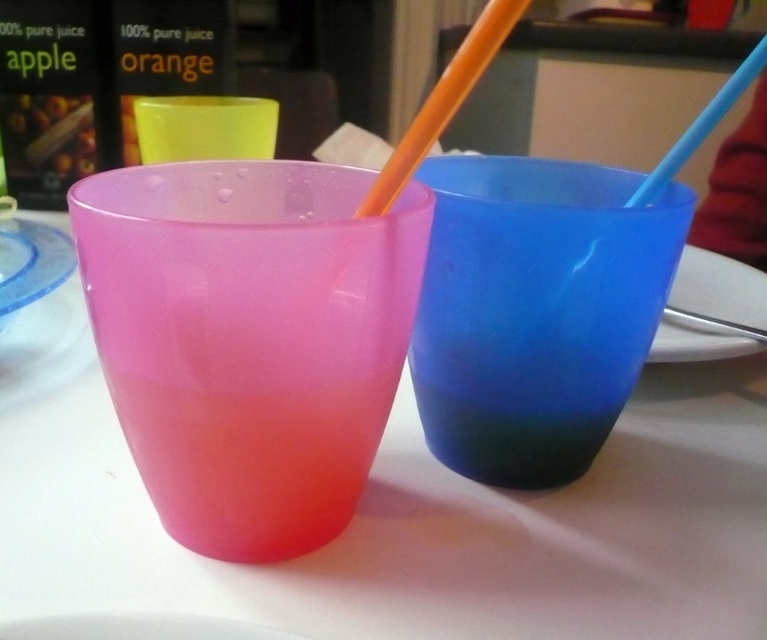
Which is behind, point (31, 604) or point (212, 508)?

Positioned behind is point (212, 508).

Is transparent plastic cups at center closer to camera compared to frosted pink cup at left?

No, transparent plastic cups at center is further to the viewer.

Describe the element at coordinates (423, 529) in the screenshot. This screenshot has height=640, width=767. I see `transparent plastic cups at center` at that location.

Locate an element on the screen. transparent plastic cups at center is located at coordinates (423, 529).

This screenshot has width=767, height=640. What do you see at coordinates (249, 339) in the screenshot?
I see `frosted pink cup at left` at bounding box center [249, 339].

Is frosted pink cup at left positioned before transparent plastic plate at center?

Yes.

Is point (311, 321) farther from camera compared to point (680, 284)?

No, (311, 321) is in front of (680, 284).

Locate an element on the screen. Image resolution: width=767 pixels, height=640 pixels. frosted pink cup at left is located at coordinates (249, 339).

Describe the element at coordinates (249, 339) in the screenshot. I see `frosted pink cup at left` at that location.

Is frosted pink cup at left wider than transparent blue cup at right?

No.

Is point (397, 289) positioned before point (647, 342)?

Yes.

You are a GUI agent. You are given a task and a screenshot of the screen. Output one action in this format:
    pyautogui.click(x=<x>, y=<y>)
    Task: Click on the frosted pink cup at left
    
    Given the screenshot: What is the action you would take?
    point(249,339)